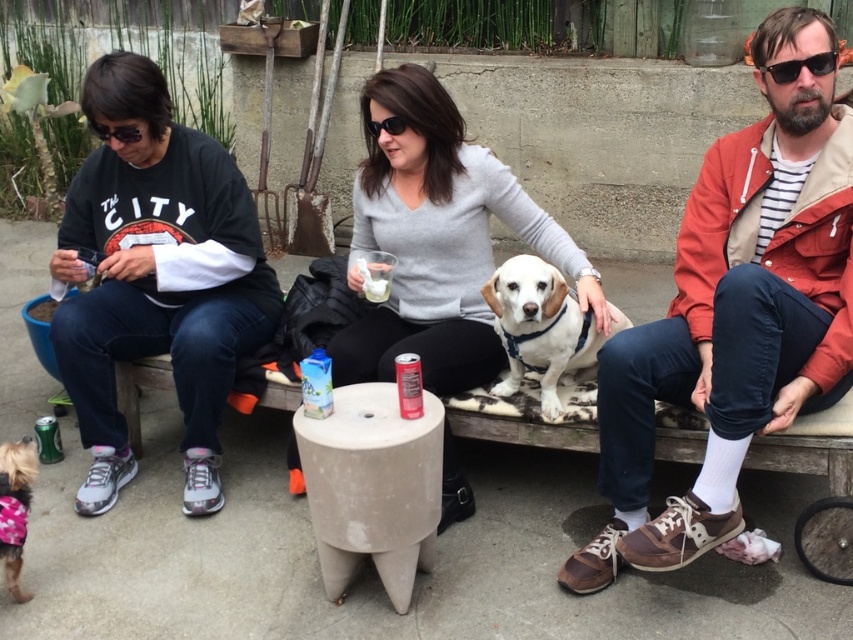
Is gray sweater at center further to camera compared to pink fabric dog at lower left?

Yes, gray sweater at center is further from the viewer.

Between point (457, 346) and point (20, 563), which one is positioned behind?

The point (457, 346) is behind.

The width and height of the screenshot is (853, 640). Describe the element at coordinates (437, 241) in the screenshot. I see `gray sweater at center` at that location.

Identify the location of gray sweater at center. Image resolution: width=853 pixels, height=640 pixels. (437, 241).

From the picture: Between gray sweater at center and concrete textured stool at center, which one is positioned lower?

Positioned lower is concrete textured stool at center.

Does gray sweater at center have a greater width compared to concrete textured stool at center?

Yes, gray sweater at center is wider than concrete textured stool at center.

Where is `gray sweater at center`? This screenshot has height=640, width=853. gray sweater at center is located at coordinates (437, 241).

At what (x,y) coordinates should I click in order to perform the action: click on gray sweater at center. Please return your answer as a coordinate pair (x, y). This screenshot has width=853, height=640. Looking at the image, I should click on (437, 241).

Who is higher up, gray sweater at center or sunglasses at upper right?

Positioned higher is sunglasses at upper right.

Based on the photo, is gray sweater at center positioned in front of sunglasses at upper right?

No, gray sweater at center is behind sunglasses at upper right.

Is point (361, 234) positioned after point (775, 72)?

That is True.

The image size is (853, 640). Find the location of `gray sweater at center`. gray sweater at center is located at coordinates pos(437,241).